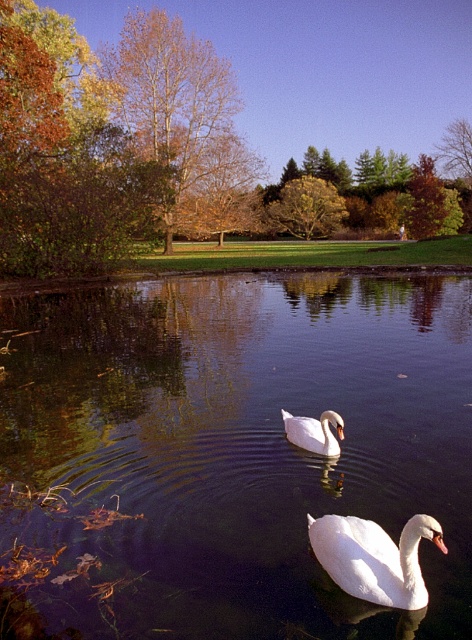
Question: Which object appears closest to the camera in this image?

Choices:
 (A) transparent water at center
 (B) white glossy swan at lower center

Answer: (B)

Question: Among these points, which one is farthest from the camera?

Choices:
 (A) (3, 388)
 (B) (439, 545)
 (C) (297, 432)

Answer: (A)

Question: Can you confirm if white glossy swan at lower center is wider than white glossy swan at center?

Choices:
 (A) no
 (B) yes

Answer: (B)

Question: Is transparent water at center below white glossy swan at center?

Choices:
 (A) yes
 (B) no

Answer: (B)

Question: Which of the following is the closest to the observer?

Choices:
 (A) (321, 452)
 (B) (446, 548)

Answer: (B)

Question: Does transparent water at center have a larger size compared to white glossy swan at lower center?

Choices:
 (A) no
 (B) yes

Answer: (B)